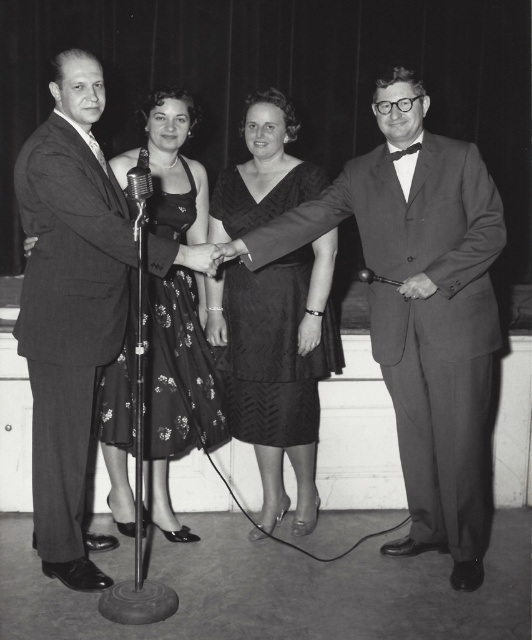
Between black textured dress at center and floral-patterned fabric dress at center, which one has more height?

Standing taller between the two is floral-patterned fabric dress at center.

Is black textured dress at center further to camera compared to floral-patterned fabric dress at center?

Yes, it is.

Who is more forward, (x=307, y=426) or (x=171, y=212)?

Positioned in front is point (x=171, y=212).

This screenshot has height=640, width=532. What are the coordinates of `black textured dress at center` in the screenshot? It's located at (273, 353).

Which is behind, point (63, 500) or point (204, 356)?

The point (204, 356) is more distant.

What do you see at coordinates (70, 307) in the screenshot?
I see `matte black suit at left` at bounding box center [70, 307].

Find the location of a particular element. matte black suit at left is located at coordinates (70, 307).

Can you confirm if matte black suit at left is smaller than black textured dress at center?

Incorrect, matte black suit at left is not smaller in size than black textured dress at center.

Is matte black suit at left wider than black textured dress at center?

Indeed, matte black suit at left has a greater width compared to black textured dress at center.

Where is `matte black suit at left`? The image size is (532, 640). matte black suit at left is located at coordinates (70, 307).